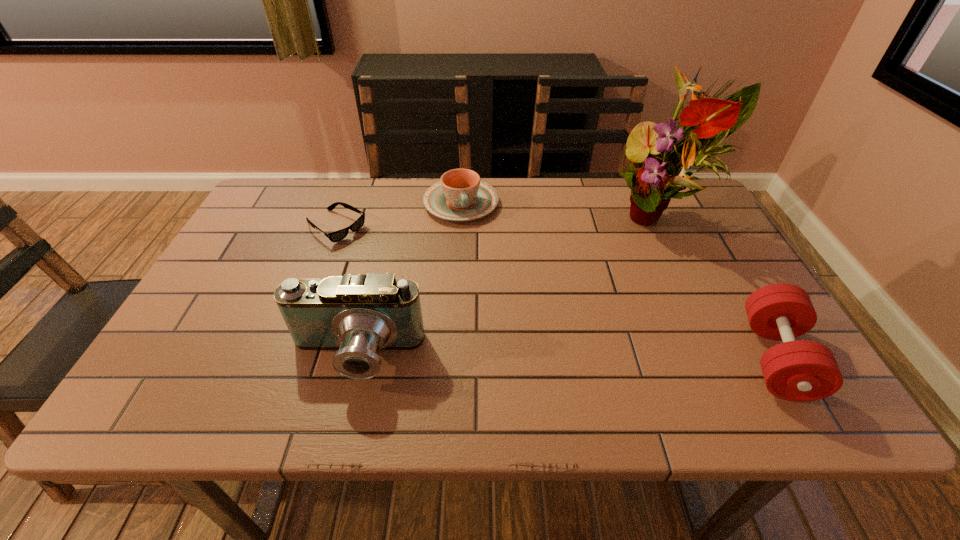
The image size is (960, 540). I want to click on vacant region located 0.060m on the handle side of the fourth tallest object, so click(x=471, y=239).

I want to click on vacant space located 0.200m on the handle side of the fourth tallest object, so click(482, 274).

Where is `free space located 0.190m on the front-facing side of the shortest object`? The height and width of the screenshot is (540, 960). free space located 0.190m on the front-facing side of the shortest object is located at coordinates (403, 270).

Image resolution: width=960 pixels, height=540 pixels. Find the location of `free space located on the front-facing side of the shortest object`. free space located on the front-facing side of the shortest object is located at coordinates (387, 260).

You are a GUI agent. You are given a task and a screenshot of the screen. Output one action in this format:
    pyautogui.click(x=<x>, y=<y>)
    Task: Click on the vacant space situated 0.180m on the front-facing side of the shortest object
    
    Given the screenshot: What is the action you would take?
    pyautogui.click(x=400, y=268)

Where is `bouquet positioned at the far edge`? The width and height of the screenshot is (960, 540). bouquet positioned at the far edge is located at coordinates (654, 179).

You are a GUI agent. You are given a task and a screenshot of the screen. Output one action in this format:
    pyautogui.click(x=<x>, y=<y>)
    Task: Click on the chinaware situated at the far edge
    This screenshot has width=960, height=540.
    Given the screenshot: What is the action you would take?
    pyautogui.click(x=460, y=195)

Locate an element on the screen. sunglasses at the far edge is located at coordinates (339, 235).

At what (x,y) coordinates should I click in order to perform the action: click on camcorder present at the near edge. Please return your answer as a coordinate pair (x, y). The width and height of the screenshot is (960, 540). Looking at the image, I should click on (358, 315).

This screenshot has width=960, height=540. I want to click on dumbbell located at the near edge, so click(x=796, y=370).